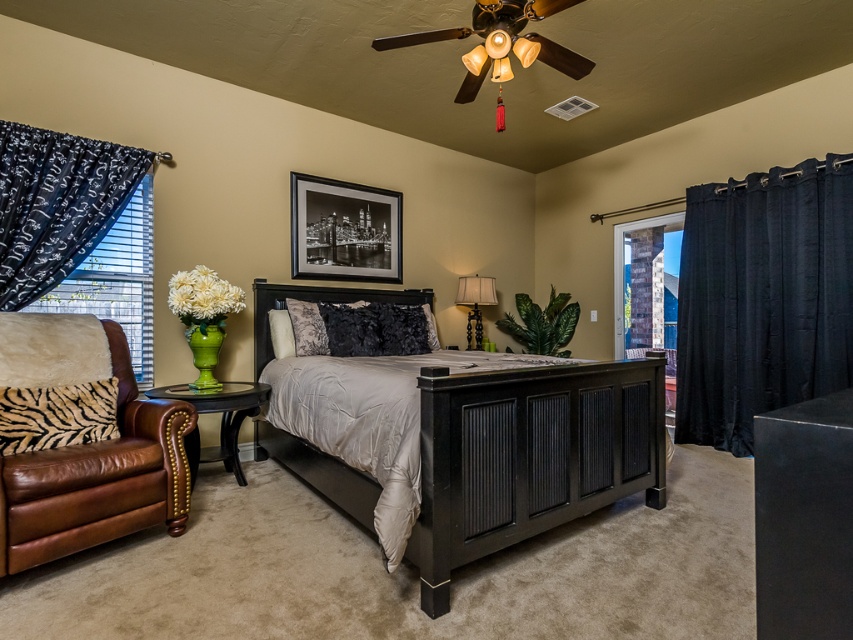
From the picture: Is brown leather armchair at lower left wider than black matte dresser at center?

Yes, brown leather armchair at lower left is wider than black matte dresser at center.

Which is more to the left, brown leather armchair at lower left or black matte dresser at center?

brown leather armchair at lower left

Is point (144, 508) positioned behind point (833, 604)?

Yes, it is behind point (833, 604).

Where is `brown leather armchair at lower left`? brown leather armchair at lower left is located at coordinates (97, 477).

Between brown leather armchair at lower left and matte black lamp at center, which one has more height?

Standing taller between the two is brown leather armchair at lower left.

Is point (76, 449) positioned in front of point (479, 317)?

Yes, point (76, 449) is closer to viewer.

What are the coordinates of `brown leather armchair at lower left` in the screenshot? It's located at (97, 477).

Does point (811, 513) lie behind point (630, 244)?

No, (811, 513) is in front of (630, 244).

Does point (775, 589) lie in front of point (674, 362)?

That is True.

Find the location of a particular element. The height and width of the screenshot is (640, 853). black matte dresser at center is located at coordinates (804, 518).